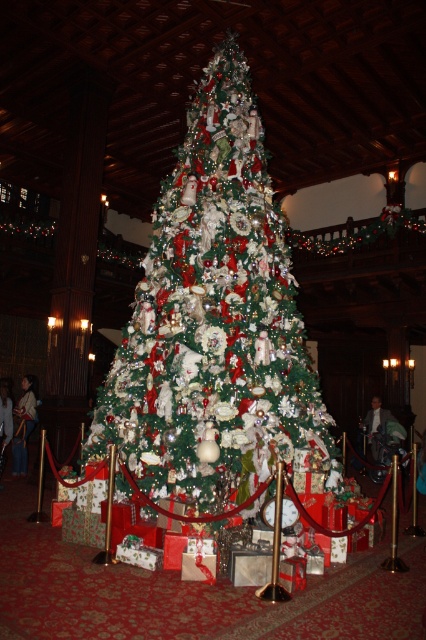
Question: Is light brown leather jacket at lower left behind white fabric dress at center?

Choices:
 (A) yes
 (B) no

Answer: (A)

Question: Which point is closer to the camera?

Choices:
 (A) (28, 419)
 (B) (0, 436)
 (C) (380, 413)
 (D) (261, 218)

Answer: (D)

Question: Does light brown leather jacket at lower left have a smaller size compared to green velvet suit at center?

Choices:
 (A) yes
 (B) no

Answer: (B)

Question: Which of the following is the closest to the observer?

Choices:
 (A) (28, 380)
 (B) (9, 396)
 (C) (388, 413)
 (D) (267, 353)

Answer: (D)

Question: Based on their relative distances, which object is farther from the green matte christmas tree at center?

Choices:
 (A) white fabric dress at center
 (B) green velvet suit at center

Answer: (B)

Question: Does green matte christmas tree at center have a lesser width compared to green velvet suit at center?

Choices:
 (A) yes
 (B) no

Answer: (B)